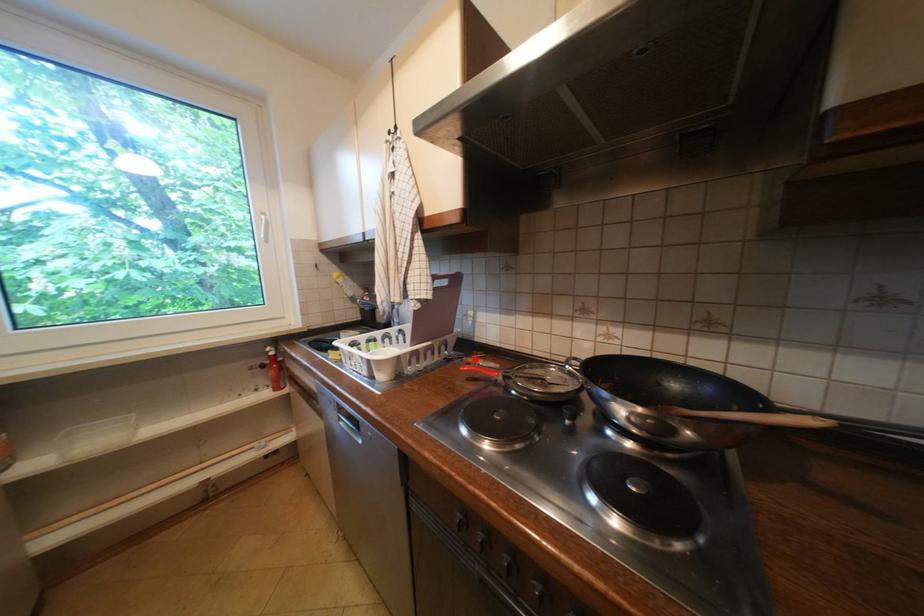
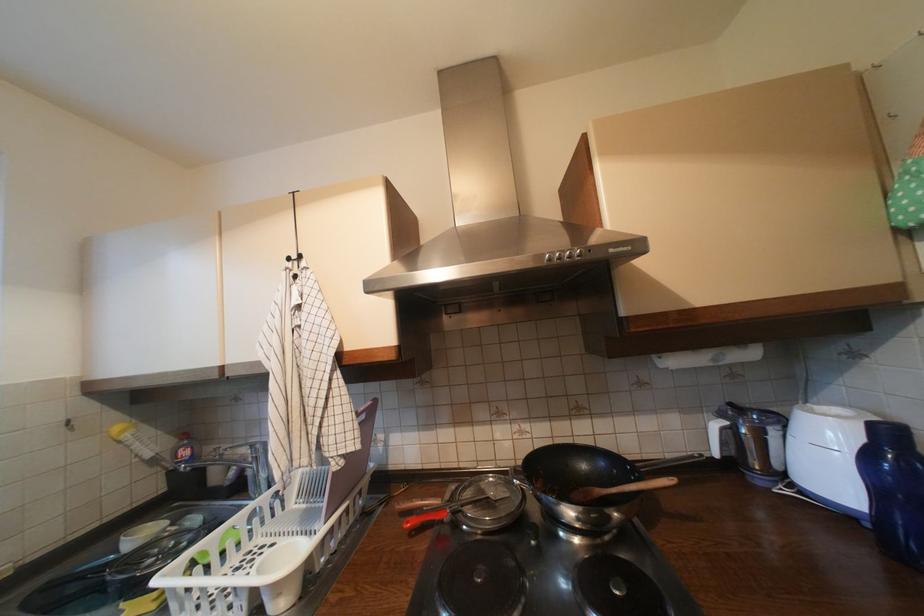
The point at the highlighted location is marked in the first image. Where is the corresponding point in the second image?

(407, 506)